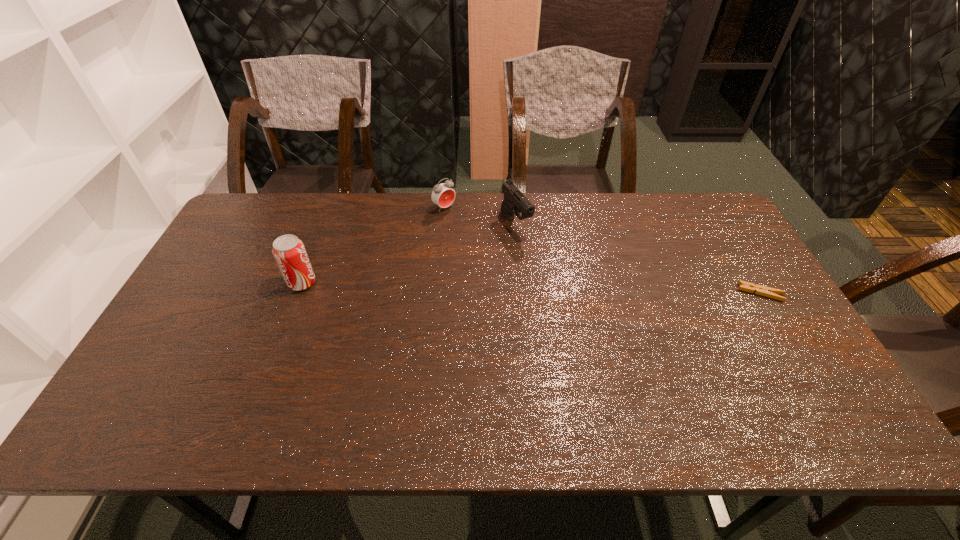
Image resolution: width=960 pixels, height=540 pixels. Find the location of `vacant space on the desktop that is between the soda can and the shortest object and is positioned at the barrel of the third object from left to right`. vacant space on the desktop that is between the soda can and the shortest object and is positioned at the barrel of the third object from left to right is located at coordinates (568, 288).

This screenshot has width=960, height=540. I want to click on vacant space on the desktop that is between the soda can and the shortest object and is positioned on the face of the third object from right to left, so click(540, 288).